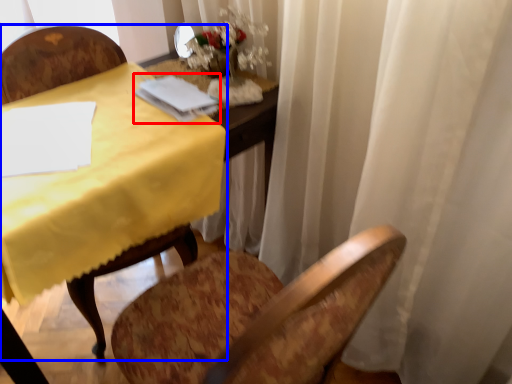
Question: Which object appears closest to the camera in this image, notebook (highlighted by a red box) or chair (highlighted by a blue box)?

Choices:
 (A) notebook
 (B) chair

Answer: (B)